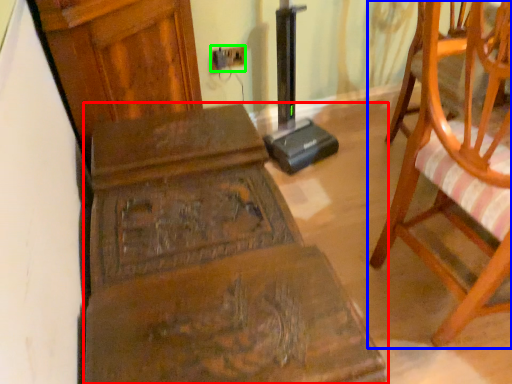
Question: Which object is the farthest from furniture (highlighted by a red box)? Choose among these: chair (highlighted by a blue box) or electric outlet (highlighted by a green box).

Choices:
 (A) chair
 (B) electric outlet

Answer: (B)